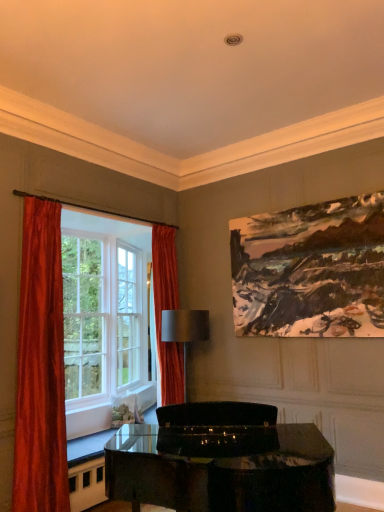
What do you see at coordinates (223, 473) in the screenshot?
I see `glossy black piano at center` at bounding box center [223, 473].

What do you see at coordinates (310, 270) in the screenshot? The image size is (384, 512). I see `oil painting at upper right` at bounding box center [310, 270].

Locate an element on the screen. This screenshot has width=384, height=512. velvet orange curtain at left, placed as the 2th curtain when sorted from back to front is located at coordinates tap(41, 367).

From the image's perspective, which one is positioned lower, orange velvet curtain at left, the second curtain in the front-to-back sequence, or velvet orange curtain at left, placed as the 2th curtain when sorted from back to front?

velvet orange curtain at left, placed as the 2th curtain when sorted from back to front, is shown below in the image.

Could you tell me if orange velvet curtain at left, the 2th curtain positioned from the left, is turned towards velvet orange curtain at left, the second curtain viewed from the right?

No, orange velvet curtain at left, the 2th curtain positioned from the left, does not turn towards velvet orange curtain at left, the second curtain viewed from the right.

Considering the positions of points (165, 392) and (46, 449), is point (165, 392) farther from camera compared to point (46, 449)?

Yes, point (165, 392) is farther from viewer.

From a real-world perspective, between orange velvet curtain at left, the second curtain in the front-to-back sequence, and velvet orange curtain at left, placed as the 2th curtain when sorted from back to front, who is vertically higher?

orange velvet curtain at left, the second curtain in the front-to-back sequence, from a real-world perspective.

Is glossy black piano at center further to the viewer compared to silky red curtains at left?

No, glossy black piano at center is in front of silky red curtains at left.

Is glossy black piano at center looking in the opposite direction of silky red curtains at left?

glossy black piano at center is not turned away from silky red curtains at left.

Does glossy black piano at center have a larger size compared to silky red curtains at left?

No.

Consider the image. Is glossy black piano at center wider than silky red curtains at left?

Yes.

Which of these two, satin gray lampshade at center or oil painting at upper right, stands shorter?

Standing shorter between the two is satin gray lampshade at center.

Consider the image. From the image's perspective, is satin gray lampshade at center above or below oil painting at upper right?

satin gray lampshade at center is situated lower than oil painting at upper right in the image.

Is satin gray lampshade at center next to oil painting at upper right?

No, satin gray lampshade at center is not touching oil painting at upper right.

Is point (35, 212) less distant than point (173, 336)?

Yes, it is.

Is silky red curtains at left next to satin gray lampshade at center and touching it?

There is a gap between silky red curtains at left and satin gray lampshade at center.

From the image's perspective, is silky red curtains at left over satin gray lampshade at center?

Yes, from the image's perspective, silky red curtains at left is over satin gray lampshade at center.

From a real-world perspective, who is located lower, silky red curtains at left or satin gray lampshade at center?

In real-world perspective, satin gray lampshade at center is lower.

Locate an element on the screen. The height and width of the screenshot is (512, 384). the 2nd curtain to the left when counting from the glossy black piano at center is located at coordinates (41, 367).

Is velvet orange curtain at left, which ranks as the first curtain in left-to-right order, directly adjacent to glossy black piano at center?

No, velvet orange curtain at left, which ranks as the first curtain in left-to-right order, is not next to glossy black piano at center.

Considering the relative sizes of velvet orange curtain at left, which ranks as the first curtain in left-to-right order, and glossy black piano at center in the image provided, is velvet orange curtain at left, which ranks as the first curtain in left-to-right order, bigger than glossy black piano at center?

Actually, velvet orange curtain at left, which ranks as the first curtain in left-to-right order, might be smaller than glossy black piano at center.

From a real-world perspective, is velvet orange curtain at left, which ranks as the first curtain in left-to-right order, below glossy black piano at center?

No, from a real-world perspective, velvet orange curtain at left, which ranks as the first curtain in left-to-right order, is not beneath glossy black piano at center.

Which is more to the right, silky red curtains at left or oil painting at upper right?

Positioned to the right is oil painting at upper right.

Can you confirm if silky red curtains at left is shorter than oil painting at upper right?

In fact, silky red curtains at left may be taller than oil painting at upper right.

From the image's perspective, who appears lower, silky red curtains at left or oil painting at upper right?

silky red curtains at left is shown below in the image.

Does glossy black piano at center appear on the right side of velvet orange curtain at left, the first curtain positioned from the front?

Correct, you'll find glossy black piano at center to the right of velvet orange curtain at left, the first curtain positioned from the front.

Measure the distance between glossy black piano at center and velvet orange curtain at left, placed as the 2th curtain when sorted from back to front.

glossy black piano at center and velvet orange curtain at left, placed as the 2th curtain when sorted from back to front, are 1.19 meters apart.

Is glossy black piano at center positioned with its back to velvet orange curtain at left, the second curtain viewed from the right?

No, glossy black piano at center's orientation is not away from velvet orange curtain at left, the second curtain viewed from the right.

Who is more distant, glossy black piano at center or velvet orange curtain at left, the first curtain positioned from the front?

velvet orange curtain at left, the first curtain positioned from the front.

Locate an element on the screen. The width and height of the screenshot is (384, 512). curtain that is above the velvet orange curtain at left, placed as the 2th curtain when sorted from back to front (from a real-world perspective) is located at coordinates (167, 309).

This screenshot has width=384, height=512. What are the coordinates of `window on the left of glossy black piano at center` in the screenshot? It's located at (76, 327).

From the image, which object appears to be nearer to oil painting at upper right, silky red curtains at left or velvet orange curtain at left, which ranks as the first curtain in left-to-right order?

Based on the image, silky red curtains at left appears to be nearer to oil painting at upper right.

Estimate the real-world distances between objects in this image. Which object is further from orange velvet curtain at left, which appears as the first curtain when viewed from the right, glossy black piano at center or satin gray lampshade at center?

The object further to orange velvet curtain at left, which appears as the first curtain when viewed from the right, is glossy black piano at center.

Based on their spatial positions, is satin gray lampshade at center or oil painting at upper right closer to silky red curtains at left?

satin gray lampshade at center.

From the image, which object appears to be nearer to orange velvet curtain at left, which appears as the first curtain when viewed from the right, velvet orange curtain at left, the first curtain positioned from the front, or glossy black piano at center?

Among the two, velvet orange curtain at left, the first curtain positioned from the front, is located nearer to orange velvet curtain at left, which appears as the first curtain when viewed from the right.

Looking at the image, which one is located closer to velvet orange curtain at left, which ranks as the first curtain in left-to-right order, glossy black piano at center or silky red curtains at left?

The object closer to velvet orange curtain at left, which ranks as the first curtain in left-to-right order, is silky red curtains at left.

Estimate the real-world distances between objects in this image. Which object is further from oil painting at upper right, velvet orange curtain at left, the first curtain positioned from the front, or orange velvet curtain at left, the second curtain in the front-to-back sequence?

velvet orange curtain at left, the first curtain positioned from the front, is further to oil painting at upper right.

Based on their spatial positions, is silky red curtains at left or orange velvet curtain at left, which appears as the 1th curtain when viewed from the back, closer to satin gray lampshade at center?

orange velvet curtain at left, which appears as the 1th curtain when viewed from the back.

When comparing their distances from satin gray lampshade at center, does orange velvet curtain at left, the 2th curtain positioned from the left, or glossy black piano at center seem further?

Based on the image, glossy black piano at center appears to be further to satin gray lampshade at center.

The width and height of the screenshot is (384, 512). Identify the location of curtain between silky red curtains at left and oil painting at upper right in the horizontal direction. click(x=167, y=309).

At what (x,y) coordinates should I click in order to perform the action: click on window between glossy black piano at center and orange velvet curtain at left, the second curtain in the front-to-back sequence, in the front-back direction. Please return your answer as a coordinate pair (x, y). This screenshot has height=512, width=384. Looking at the image, I should click on (76, 327).

Locate an element on the screen. The width and height of the screenshot is (384, 512). window located between velvet orange curtain at left, placed as the 2th curtain when sorted from back to front, and satin gray lampshade at center in the left-right direction is located at coordinates (76, 327).

I want to click on window between velvet orange curtain at left, placed as the 2th curtain when sorted from back to front, and orange velvet curtain at left, which appears as the 1th curtain when viewed from the back, in the front-back direction, so 76,327.